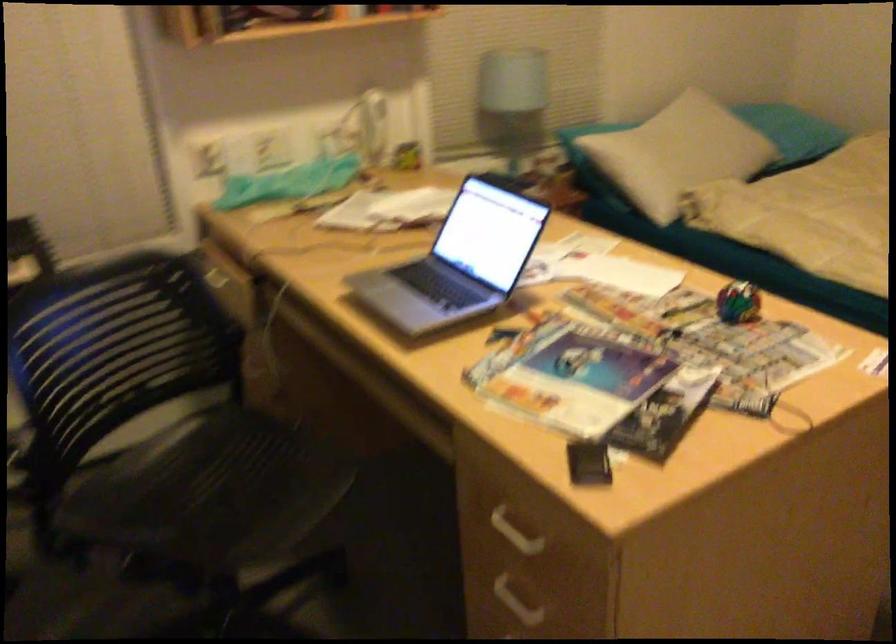
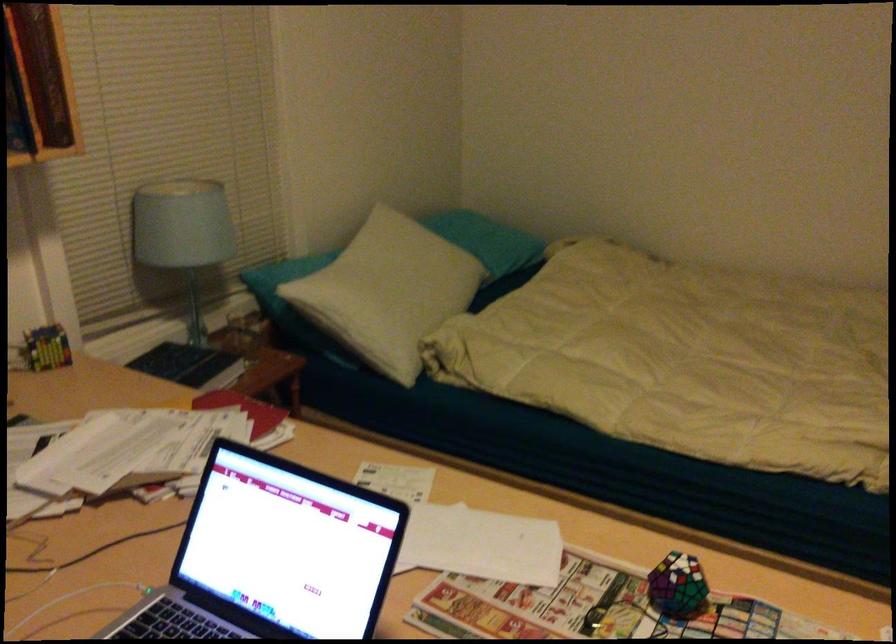
In the second image, find the point that corresponds to (734,301) in the first image.

(677, 585)